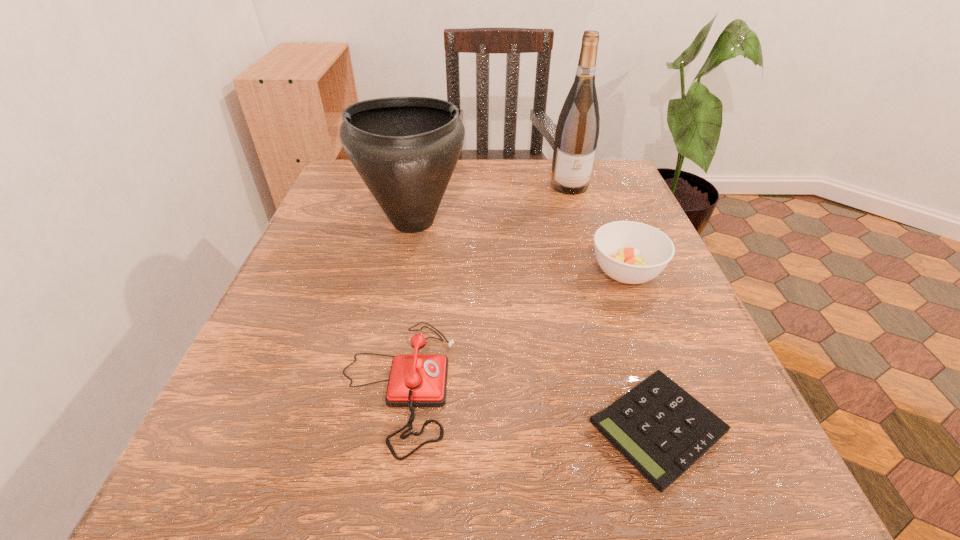
Where is `unoccupied position between the fourth shortest object and the soup bowl`? The width and height of the screenshot is (960, 540). unoccupied position between the fourth shortest object and the soup bowl is located at coordinates (x=519, y=247).

Locate an element on the screen. vacant area between the calculator and the tallest object is located at coordinates (613, 307).

Find the location of a particular element. vacant space in between the soup bowl and the telephone is located at coordinates (512, 328).

You are a GUI agent. You are given a task and a screenshot of the screen. Output one action in this format:
    pyautogui.click(x=<x>, y=<y>)
    Task: Click on the empty location between the urn and the telephone
    Image resolution: width=960 pixels, height=540 pixels.
    Given the screenshot: What is the action you would take?
    pyautogui.click(x=405, y=303)

At what (x,y) coordinates should I click in order to perform the action: click on free space between the urn and the shortest object. Please return your answer as a coordinate pair (x, y). Looking at the image, I should click on (536, 325).

Identify the location of free point between the tallest object and the shortest object. (613, 307).

Find the location of a particular element. This screenshot has height=540, width=960. vacant region between the soup bowl and the urn is located at coordinates (519, 247).

Where is `free area in between the tallest object and the fourth shortest object`? This screenshot has width=960, height=540. free area in between the tallest object and the fourth shortest object is located at coordinates (492, 204).

Find the location of a particular element. This screenshot has height=540, width=960. free point between the calculator and the urn is located at coordinates (536, 325).

This screenshot has width=960, height=540. What are the coordinates of `object that is the fourth closest to the telephone` in the screenshot? It's located at (577, 131).